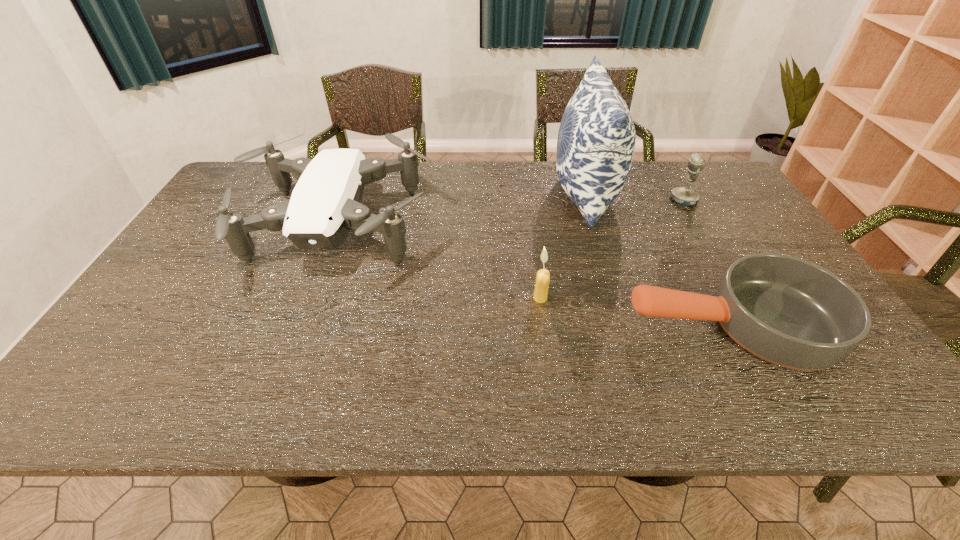
The width and height of the screenshot is (960, 540). Identify the location of microphone positioned at the right edge. (686, 196).

Identify the location of pan present at the right edge. (784, 310).

Where is `object located in the far left corner section of the desktop`? This screenshot has height=540, width=960. object located in the far left corner section of the desktop is located at coordinates (325, 205).

You are a GUI agent. You are given a task and a screenshot of the screen. Output one action in this format:
    pyautogui.click(x=<x>, y=<y>)
    Task: Click on the object present at the far right corner
    
    Given the screenshot: What is the action you would take?
    click(x=686, y=196)

You are a GUI agent. You are given a task and a screenshot of the screen. Output one action in this format:
    pyautogui.click(x=<x>, y=<y>)
    Task: Click on the blank area at the far edge
    
    Given the screenshot: What is the action you would take?
    pyautogui.click(x=436, y=191)

Where is `vacant space at the near edge`? This screenshot has height=540, width=960. vacant space at the near edge is located at coordinates (536, 381).

You are a GUI agent. You are given a task and a screenshot of the screen. Output one action in this format:
    pyautogui.click(x=<x>, y=<y>)
    Task: Click on the vacant space at the left edge of the desktop
    
    Given the screenshot: What is the action you would take?
    pyautogui.click(x=143, y=298)

Where is `free region at the far left corner of the desktop`? free region at the far left corner of the desktop is located at coordinates (256, 194).

Where is `empty space that is in between the leftmost object and the microphone`? empty space that is in between the leftmost object and the microphone is located at coordinates (511, 213).

At what (x,y) coordinates should I click in order to perform the action: click on free space between the leftmost object and the cushion. Please return your answer as a coordinate pair (x, y). This screenshot has width=960, height=540. Looking at the image, I should click on (461, 210).